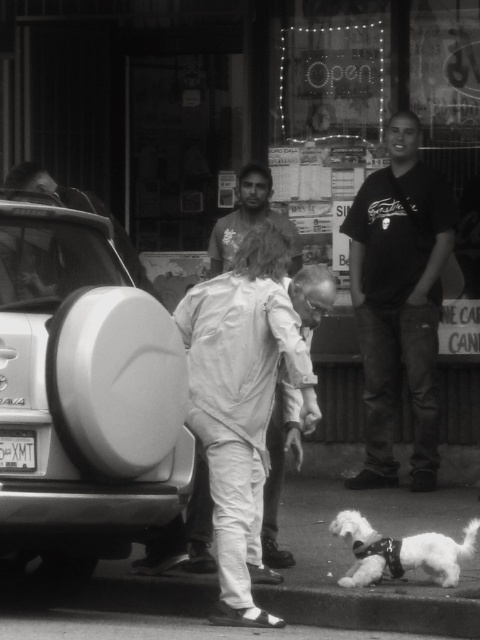
Is white soft fur dog at lower right taller than smooth skin man at center?

Incorrect, white soft fur dog at lower right's height is not larger of smooth skin man at center's.

Which is behind, point (432, 566) or point (295, 228)?

The point (295, 228) is more distant.

Between point (444, 566) and point (274, 225), which one is positioned in front?

Positioned in front is point (444, 566).

Locate an element on the screen. The height and width of the screenshot is (640, 480). white soft fur dog at lower right is located at coordinates (400, 552).

Is point (415, 468) behind point (243, 224)?

No, it is in front of (243, 224).

This screenshot has width=480, height=640. What do you see at coordinates (398, 300) in the screenshot?
I see `dark cotton t-shirt at center` at bounding box center [398, 300].

The width and height of the screenshot is (480, 640). I want to click on dark cotton t-shirt at center, so click(x=398, y=300).

Who is lower down, white matte suit at center or black plastic license plate at lower left?

Positioned lower is black plastic license plate at lower left.

Who is more forward, [254,182] or [33,461]?

Point [33,461] is more forward.

Between point (194, 522) and point (24, 432), which one is positioned in front?

Point (24, 432)

Image resolution: width=480 pixels, height=640 pixels. What are the coordinates of `white matte suit at center` in the screenshot? It's located at [250, 220].